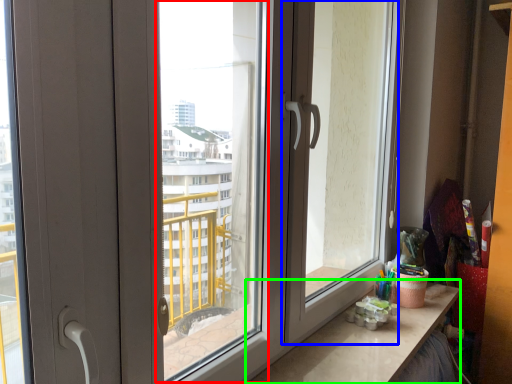
Question: Which object is the closest to the window screen (highlighted by a red box)? Choose among these: screen door (highlighted by a blue box) or counter top (highlighted by a green box).

Choices:
 (A) screen door
 (B) counter top

Answer: (A)